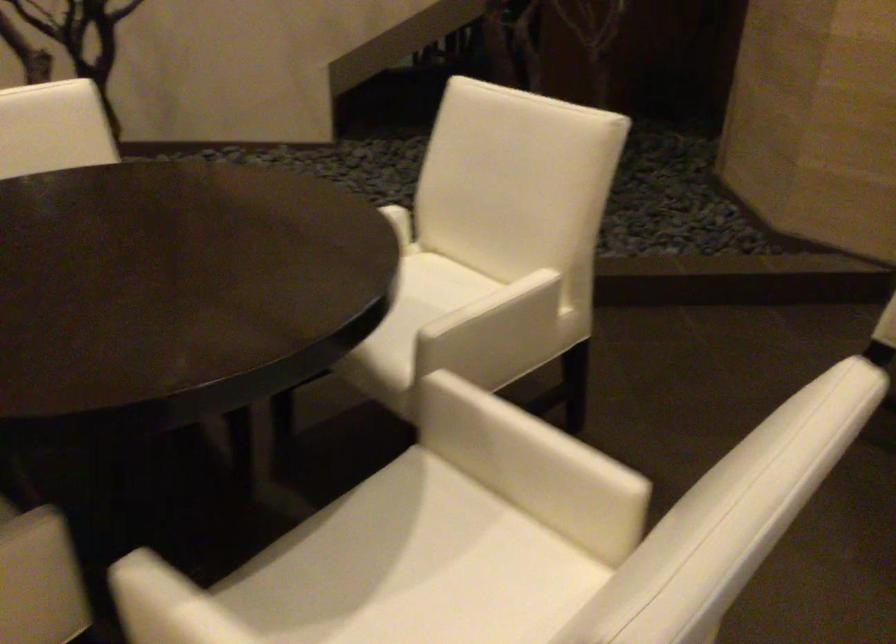
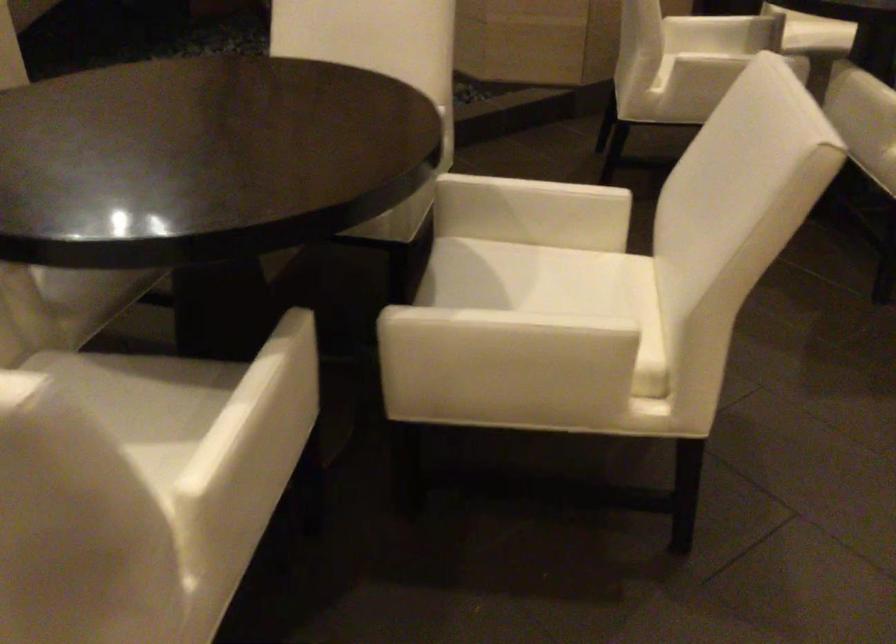
Find the pixel in the second image that matches point (410, 529) in the first image.

(490, 272)